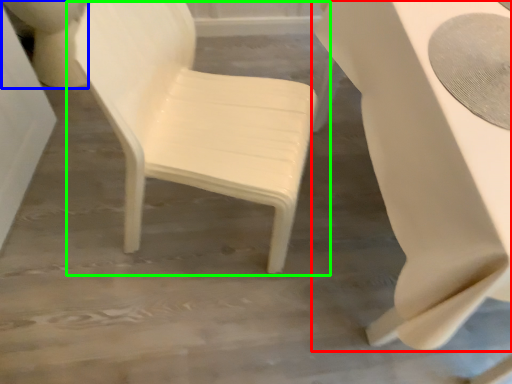
Question: Which object is the closest to the table (highlighted by a red box)? Choose among these: toilet bowl (highlighted by a blue box) or chair (highlighted by a green box).

Choices:
 (A) toilet bowl
 (B) chair

Answer: (B)